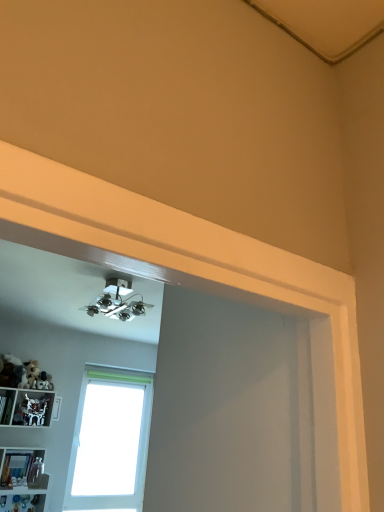
Question: Is white plastic shelf at lower left, arranged as the first shelf when viewed from the top, surrounding white frosted glass window at center?

Choices:
 (A) yes
 (B) no

Answer: (B)

Question: Is white plastic shelf at lower left, which is the second shelf from bottom to top, outside of white frosted glass window at center?

Choices:
 (A) yes
 (B) no

Answer: (A)

Question: From a real-world perspective, is white plastic shelf at lower left, arranged as the first shelf when viewed from the top, positioned over white frosted glass window at center based on gravity?

Choices:
 (A) yes
 (B) no

Answer: (A)

Question: Does white plastic shelf at lower left, which is the second shelf from bottom to top, have a smaller size compared to white frosted glass window at center?

Choices:
 (A) yes
 (B) no

Answer: (A)

Question: Can you confirm if white plastic shelf at lower left, arranged as the first shelf when viewed from the top, is shorter than white frosted glass window at center?

Choices:
 (A) yes
 (B) no

Answer: (A)

Question: Are white plastic shelf at lower left, arranged as the first shelf when viewed from the top, and white frosted glass window at center far apart?

Choices:
 (A) yes
 (B) no

Answer: (B)

Question: Is white frosted glass window at center not close to white plastic shelf at lower left, arranged as the first shelf when viewed from the top?

Choices:
 (A) no
 (B) yes

Answer: (A)

Question: Is white plastic shelf at lower left, which is the second shelf from bottom to top, inside white frosted glass window at center?

Choices:
 (A) yes
 (B) no

Answer: (B)

Question: From a real-world perspective, does white frosted glass window at center stand above white plastic shelf at lower left, which is the second shelf from bottom to top?

Choices:
 (A) no
 (B) yes

Answer: (A)

Question: From the image's perspective, does white frosted glass window at center appear higher than white plastic shelf at lower left, arranged as the first shelf when viewed from the top?

Choices:
 (A) no
 (B) yes

Answer: (A)

Question: Does white frosted glass window at center have a smaller size compared to white plastic shelf at lower left, arranged as the first shelf when viewed from the top?

Choices:
 (A) no
 (B) yes

Answer: (A)

Question: Are white frosted glass window at center and white plastic shelf at lower left, arranged as the first shelf when viewed from the top, making contact?

Choices:
 (A) yes
 (B) no

Answer: (B)

Question: Is the position of translucent plastic bottles at lower left, the 2th shelf when ordered from top to bottom, less distant than that of white plastic shelf at lower left, arranged as the first shelf when viewed from the top?

Choices:
 (A) yes
 (B) no

Answer: (A)